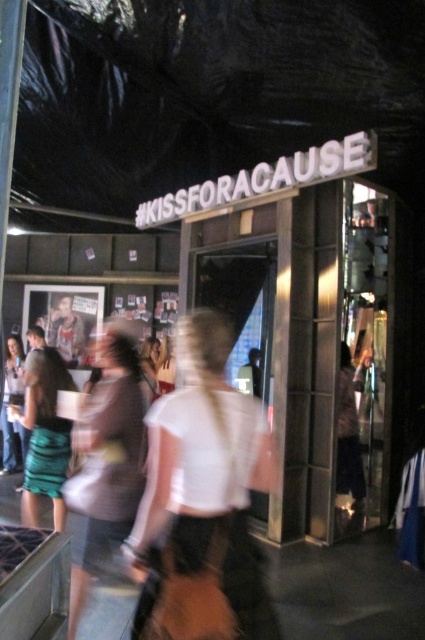
Question: Among these objects, which one is nearest to the camera?

Choices:
 (A) white cotton shirt at center
 (B) white matte shirt at center
 (C) dark gray sweater at center
 (D) green satin dress at left

Answer: (B)

Question: Can you confirm if white matte shirt at center is wider than green satin dress at left?

Choices:
 (A) no
 (B) yes

Answer: (B)

Question: Based on their relative distances, which object is farther from the dark gray sweater at center?

Choices:
 (A) green satin dress at left
 (B) white matte shirt at center

Answer: (B)

Question: Where is white matte shirt at center located in relation to white cotton shirt at center in the image?

Choices:
 (A) left
 (B) right

Answer: (B)

Question: Which point is closer to the camera?

Choices:
 (A) (155, 468)
 (B) (62, 474)
 (C) (348, 424)
 (D) (122, 413)

Answer: (A)

Question: Can you confirm if white matte shirt at center is bigger than dark gray sweater at center?

Choices:
 (A) yes
 (B) no

Answer: (B)